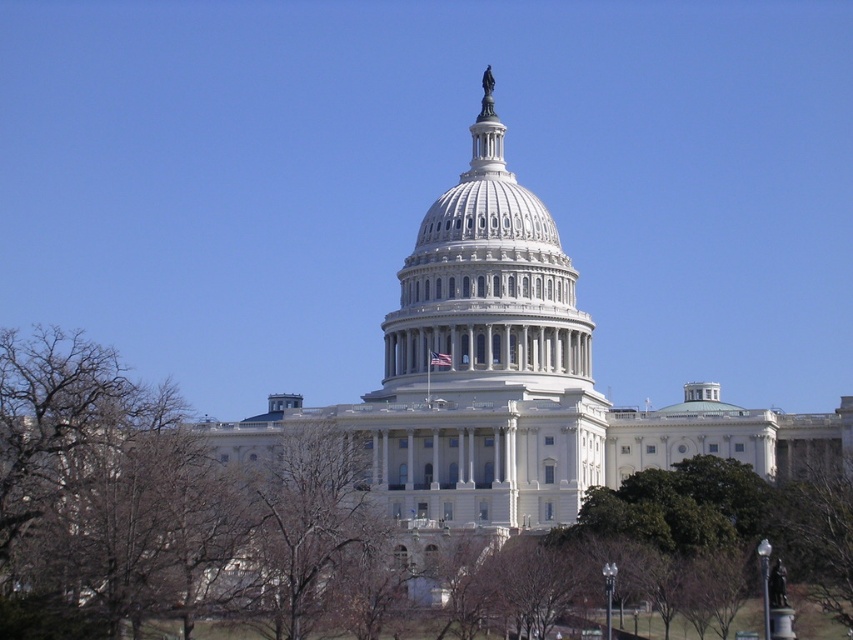
Is white marble dome at center to the left of bare branches at center from the viewer's perspective?

Incorrect, white marble dome at center is not on the left side of bare branches at center.

Looking at this image, can you confirm if white marble dome at center is shorter than bare branches at center?

No, white marble dome at center is not shorter than bare branches at center.

Is point (480, 241) less distant than point (315, 451)?

That is False.

The width and height of the screenshot is (853, 640). What are the coordinates of `white marble dome at center` in the screenshot? It's located at (486, 289).

Can you confirm if brown leafless tree at lower left is positioned below white marble dome at center?

Yes, brown leafless tree at lower left is below white marble dome at center.

Can you confirm if brown leafless tree at lower left is smaller than white marble dome at center?

Actually, brown leafless tree at lower left might be larger than white marble dome at center.

What are the coordinates of `brown leafless tree at lower left` in the screenshot? It's located at (357, 480).

Between brown leafless tree at lower left and bare branches at center, which one has more height?

brown leafless tree at lower left

Who is positioned more to the left, brown leafless tree at lower left or bare branches at center?

brown leafless tree at lower left is more to the left.

What do you see at coordinates (357, 480) in the screenshot?
I see `brown leafless tree at lower left` at bounding box center [357, 480].

This screenshot has width=853, height=640. Find the location of `brown leafless tree at lower left`. brown leafless tree at lower left is located at coordinates (357, 480).